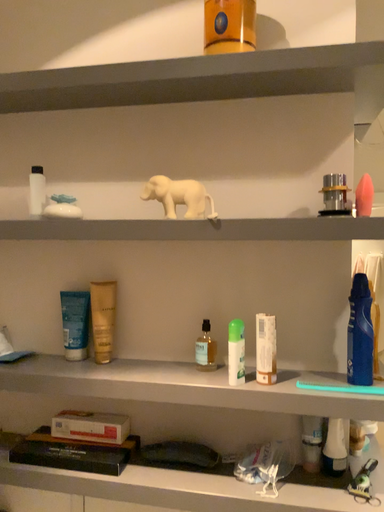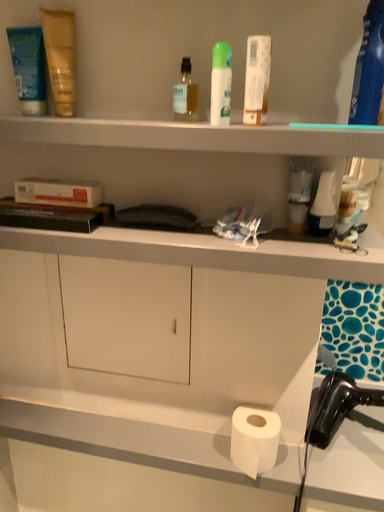
Question: How did the camera likely rotate when shooting the video?

Choices:
 (A) rotated upward
 (B) rotated downward

Answer: (B)